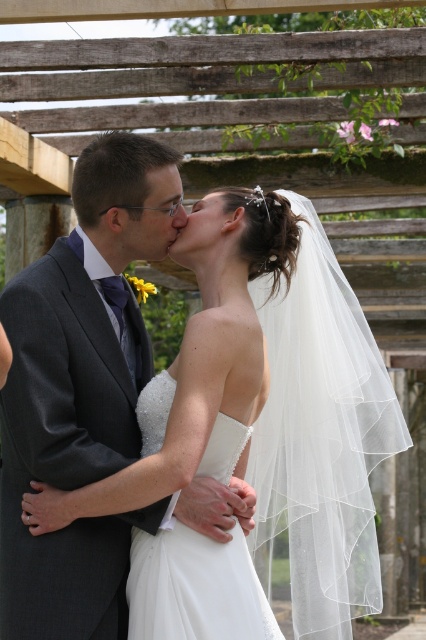
From the picture: Is white satin wedding dress at center closer to the viewer compared to matte white forehead at upper center?

Yes, it is in front of matte white forehead at upper center.

In the scene shown: Does white satin wedding dress at center appear under matte white forehead at upper center?

Yes, white satin wedding dress at center is below matte white forehead at upper center.

Is point (144, 417) in front of point (224, 189)?

That is True.

Identify the location of white satin wedding dress at center. (195, 586).